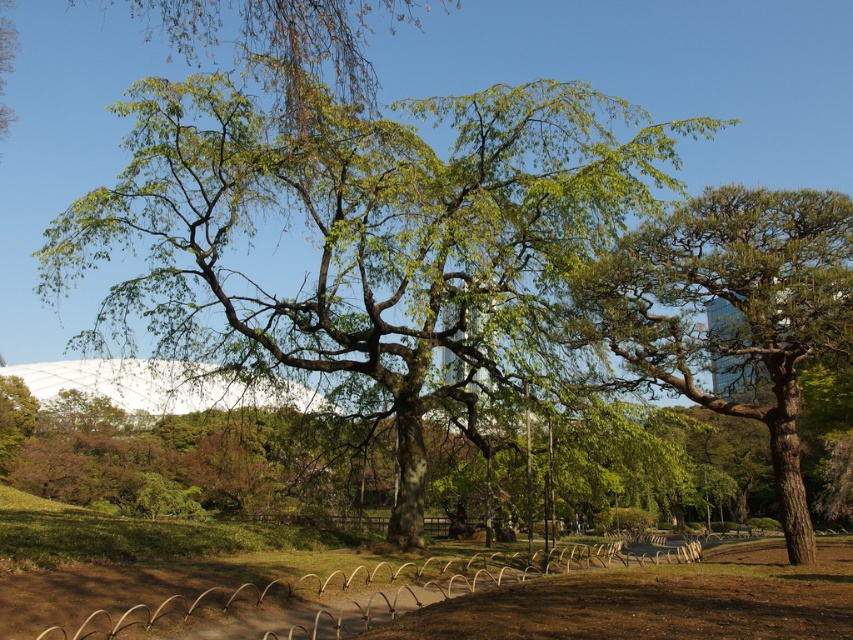
Is green leafy oak tree at center to the right of green textured tree at right from the viewer's perspective?

In fact, green leafy oak tree at center is to the left of green textured tree at right.

Who is shorter, green leafy oak tree at center or green textured tree at right?

green textured tree at right

Identify the location of green leafy oak tree at center. The image size is (853, 640). (364, 240).